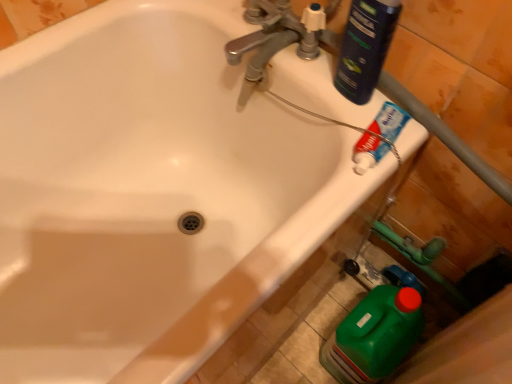
Question: Does dark blue plastic bottle at upper right, which appears as the first cleaning product when viewed from the front, appear on the right side of silver metallic faucet at upper center?

Choices:
 (A) no
 (B) yes

Answer: (B)

Question: Can you confirm if dark blue plastic bottle at upper right, arranged as the second cleaning product when viewed from the back, is positioned to the left of silver metallic faucet at upper center?

Choices:
 (A) no
 (B) yes

Answer: (A)

Question: From a real-world perspective, is dark blue plastic bottle at upper right, arranged as the second cleaning product when viewed from the back, positioned under silver metallic faucet at upper center based on gravity?

Choices:
 (A) no
 (B) yes

Answer: (A)

Question: Considering the relative sizes of dark blue plastic bottle at upper right, which appears as the 1th cleaning product when viewed from the top, and silver metallic faucet at upper center in the image provided, is dark blue plastic bottle at upper right, which appears as the 1th cleaning product when viewed from the top, smaller than silver metallic faucet at upper center?

Choices:
 (A) no
 (B) yes

Answer: (B)

Question: Does dark blue plastic bottle at upper right, the second cleaning product positioned from the bottom, lie in front of silver metallic faucet at upper center?

Choices:
 (A) yes
 (B) no

Answer: (A)

Question: From the image's perspective, would you say dark blue plastic bottle at upper right, which appears as the first cleaning product when viewed from the front, is positioned over silver metallic faucet at upper center?

Choices:
 (A) no
 (B) yes

Answer: (A)

Question: From the image's perspective, does dark blue plastic bottle at upper right, arranged as the second cleaning product when viewed from the back, appear lower than white glossy toothpaste at upper right?

Choices:
 (A) yes
 (B) no

Answer: (B)

Question: From a real-world perspective, is dark blue plastic bottle at upper right, arranged as the second cleaning product when viewed from the back, physically above white glossy toothpaste at upper right?

Choices:
 (A) no
 (B) yes

Answer: (B)

Question: Does dark blue plastic bottle at upper right, the second cleaning product positioned from the bottom, have a larger size compared to white glossy toothpaste at upper right?

Choices:
 (A) yes
 (B) no

Answer: (A)

Question: From a real-world perspective, does dark blue plastic bottle at upper right, which appears as the first cleaning product when viewed from the front, sit lower than white glossy toothpaste at upper right?

Choices:
 (A) no
 (B) yes

Answer: (A)

Question: Is dark blue plastic bottle at upper right, which appears as the 1th cleaning product when viewed from the top, behind white glossy toothpaste at upper right?

Choices:
 (A) yes
 (B) no

Answer: (B)

Question: Is dark blue plastic bottle at upper right, which appears as the 1th cleaning product when viewed from the top, not within white glossy toothpaste at upper right?

Choices:
 (A) yes
 (B) no

Answer: (A)

Question: From a real-world perspective, is silver metallic faucet at upper center under dark blue plastic bottle at upper right, arranged as the second cleaning product when viewed from the back?

Choices:
 (A) no
 (B) yes

Answer: (B)